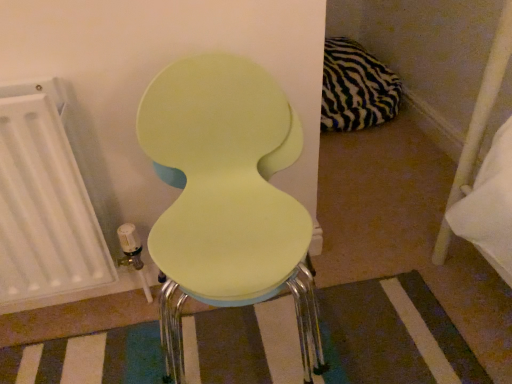
The image size is (512, 384). Find the location of `free space to the right of matte green chair at center`. free space to the right of matte green chair at center is located at coordinates (389, 325).